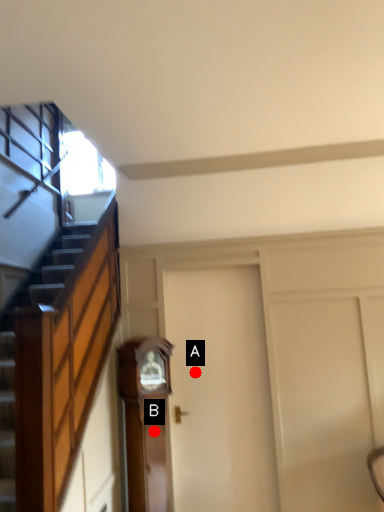
Question: Two points are circled on the image, labeled by A and B beside each circle. Among these points, which one is nearest to the camera?

Choices:
 (A) A is closer
 (B) B is closer

Answer: (B)